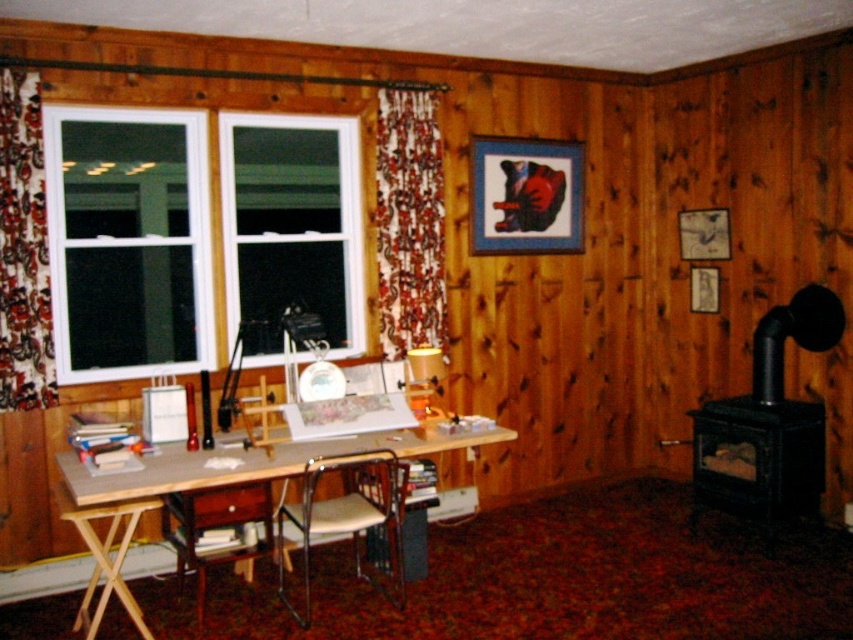
Does point (90, 248) come closer to viewer compared to point (679, 234)?

Yes, point (90, 248) is in front of point (679, 234).

Between white plastic window at left and metallic silver picture frame at upper right, which one appears on the right side from the viewer's perspective?

From the viewer's perspective, metallic silver picture frame at upper right appears more on the right side.

At what (x,y) coordinates should I click in order to perform the action: click on white plastic window at left. Please return your answer as a coordinate pair (x, y). This screenshot has height=640, width=853. Looking at the image, I should click on (128, 241).

Which is behind, point (260, 444) or point (706, 221)?

Positioned behind is point (706, 221).

Can you confirm if light brown wooden table at lower left is positioned to the left of metallic silver picture frame at upper right?

Correct, you'll find light brown wooden table at lower left to the left of metallic silver picture frame at upper right.

Where is `light brown wooden table at lower left`? This screenshot has width=853, height=640. light brown wooden table at lower left is located at coordinates (228, 476).

At what (x,y) coordinates should I click in order to perform the action: click on light brown wooden table at lower left. Please return your answer as a coordinate pair (x, y). Image resolution: width=853 pixels, height=640 pixels. Looking at the image, I should click on (228, 476).

Between white glass window at upper left and metallic silver chair at center, which one has more height?

Standing taller between the two is white glass window at upper left.

Is white glass window at upper left above metallic silver chair at center?

Yes.

Between point (332, 256) and point (283, 500), which one is positioned behind?

Positioned behind is point (332, 256).

You are a GUI agent. You are given a task and a screenshot of the screen. Output one action in this format:
    pyautogui.click(x=<x>, y=<y>)
    Task: Click on the white glass window at upper left
    The image size is (853, 640).
    Given the screenshot: What is the action you would take?
    pyautogui.click(x=292, y=221)